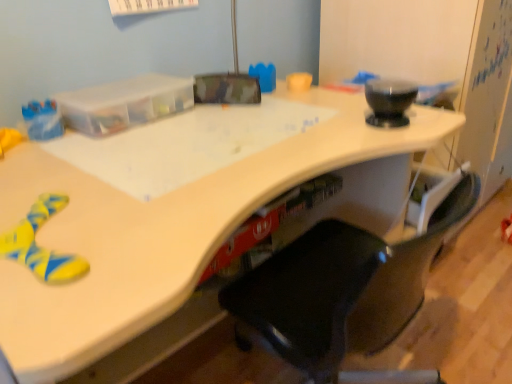
The height and width of the screenshot is (384, 512). I want to click on free spot to the left of rubberized red toy at lower right, so click(478, 240).